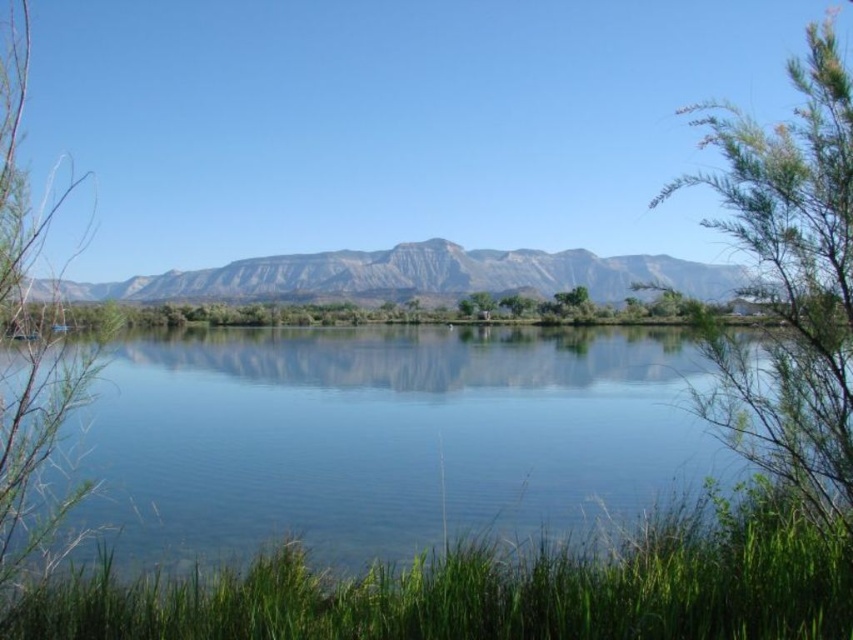
Question: Which of these objects is positioned farthest from the green leafy tree at center?

Choices:
 (A) green leafy bush at right
 (B) green grass at lower center

Answer: (A)

Question: Considering the relative positions of green leafy bush at right and green leafy tree at center in the image provided, where is green leafy bush at right located with respect to green leafy tree at center?

Choices:
 (A) right
 (B) left

Answer: (B)

Question: Which object is closer to the camera taking this photo?

Choices:
 (A) green grass at lower center
 (B) green leafy tree at center

Answer: (A)

Question: Which of the following is the farthest from the observer?

Choices:
 (A) green leafy tree at left
 (B) green grass at lower center

Answer: (B)

Question: Can you confirm if rustic stone mountain at center is positioned to the left of green leafy tree at center?

Choices:
 (A) yes
 (B) no

Answer: (A)

Question: Can you confirm if green leafy bush at right is positioned to the right of green leafy tree at center?

Choices:
 (A) no
 (B) yes

Answer: (A)